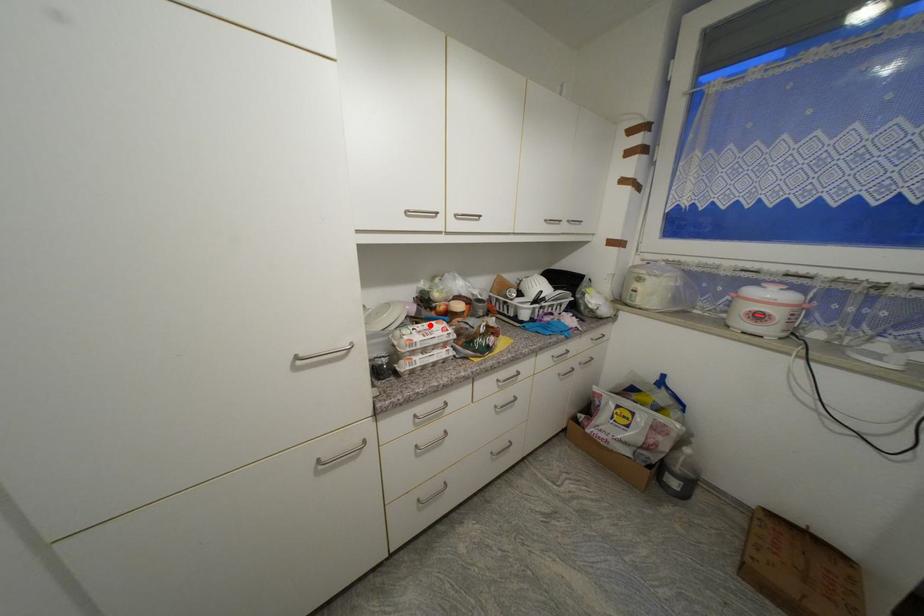
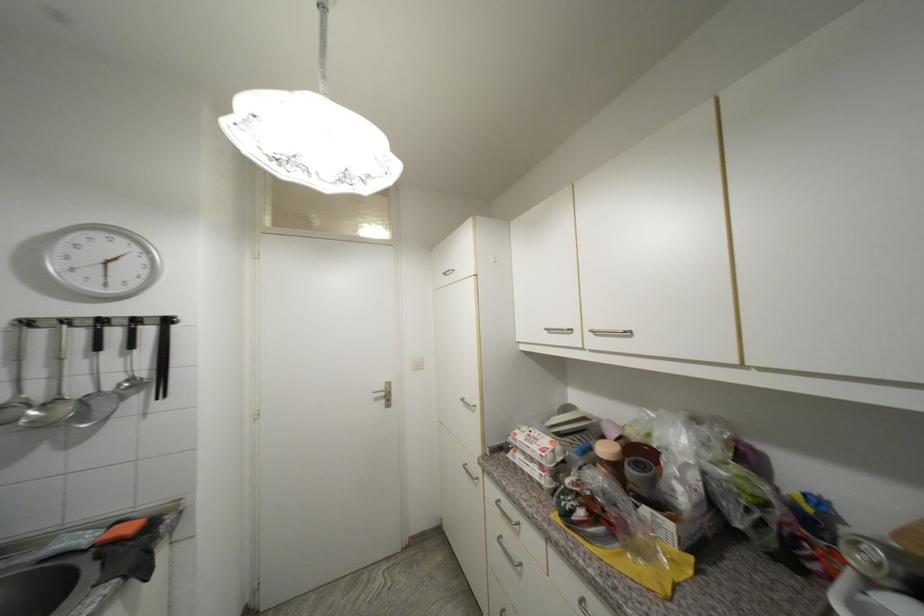
In the second image, find the point that corresponds to the highlighted location in the first image.

(548, 436)